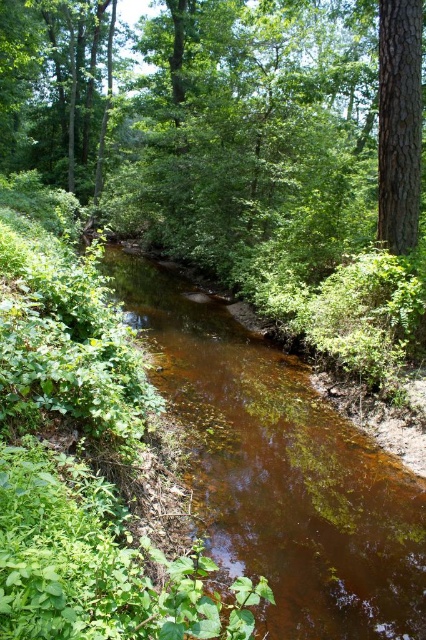
Question: Is brown translucent water at center bigger than smooth brown tree trunk at upper right?

Choices:
 (A) yes
 (B) no

Answer: (A)

Question: Is brown translucent water at center below smooth brown tree trunk at upper right?

Choices:
 (A) no
 (B) yes

Answer: (B)

Question: Which of the following is the farthest from the observer?

Choices:
 (A) (397, 129)
 (B) (350, 467)

Answer: (A)

Question: Considering the relative positions of brown translucent water at center and smooth brown tree trunk at upper right in the image provided, where is brown translucent water at center located with respect to smooth brown tree trunk at upper right?

Choices:
 (A) above
 (B) below

Answer: (B)